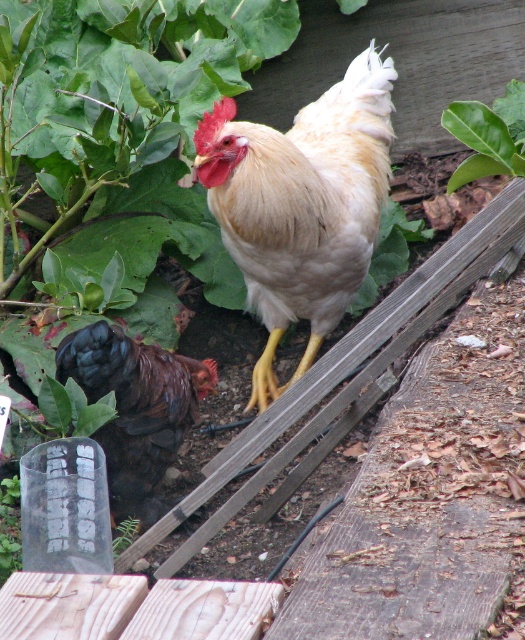
Can you confirm if golden feathered rooster at center is positioned to the right of green leafy at upper center?

No, golden feathered rooster at center is not to the right of green leafy at upper center.

Is golden feathered rooster at center thinner than green leafy at upper center?

In fact, golden feathered rooster at center might be wider than green leafy at upper center.

This screenshot has height=640, width=525. What do you see at coordinates (301, 204) in the screenshot?
I see `golden feathered rooster at center` at bounding box center [301, 204].

At what (x,y) coordinates should I click in order to perform the action: click on golden feathered rooster at center. Please return your answer as a coordinate pair (x, y). Looking at the image, I should click on (301, 204).

Can you confirm if golden feathered rooster at center is positioned to the left of dark brown feathers at center?

In fact, golden feathered rooster at center is to the right of dark brown feathers at center.

What do you see at coordinates (301, 204) in the screenshot? The width and height of the screenshot is (525, 640). I see `golden feathered rooster at center` at bounding box center [301, 204].

At what (x,y) coordinates should I click in order to perform the action: click on golden feathered rooster at center. Please return your answer as a coordinate pair (x, y). The height and width of the screenshot is (640, 525). Looking at the image, I should click on (301, 204).

Is dark brown feathers at center to the left of green leafy at upper center from the viewer's perspective?

Indeed, dark brown feathers at center is positioned on the left side of green leafy at upper center.

Can you confirm if dark brown feathers at center is taller than green leafy at upper center?

Yes, dark brown feathers at center is taller than green leafy at upper center.

In order to click on dark brown feathers at center in this screenshot , I will do `click(135, 408)`.